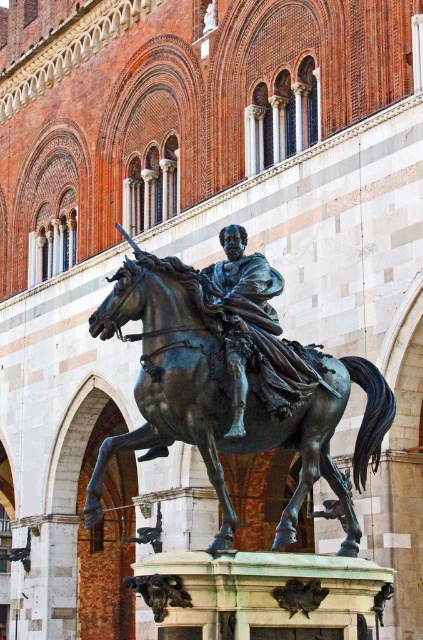
You are standing in front of the historic building and want to locate the bronze horse at center. According to the coordinates provided, where should you look relative to the building?

The bronze horse at center is located at coordinates point (228,394), which means it is positioned to the right and slightly above the center of the image, so you should look towards the right side of the building.

You are an art student analyzing the bronze equestrian statue in front of the historic building. You notice two objects at the center of the scene. Which object is taller between the bronze horse at center and the bronze statue at center?

The bronze horse at center is much taller than the bronze statue at center.

You are an art student standing in front of the bronze statue at center. You notice the bronze horse at center. Which part of the statue is closer to you?

The bronze horse at center is closer to you than the bronze statue at center because it is positioned further to the viewer.